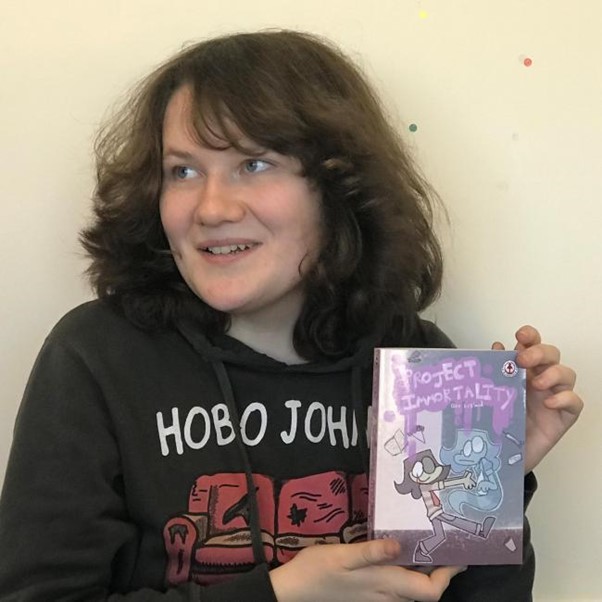
Find the location of a particular element. Image resolution: width=602 pixels, height=602 pixels. beat up sofa is located at coordinates (318, 510).